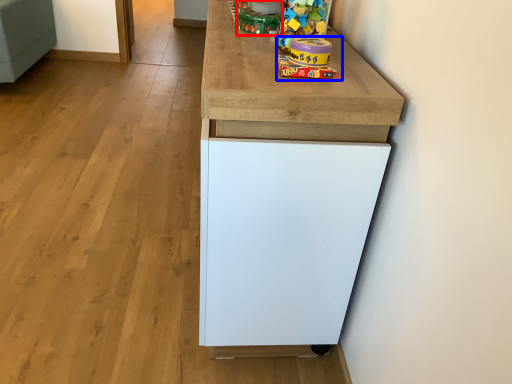
Question: Which of the following is the farthest to the observer, toy (highlighted by a red box) or toy (highlighted by a blue box)?

Choices:
 (A) toy
 (B) toy

Answer: (A)